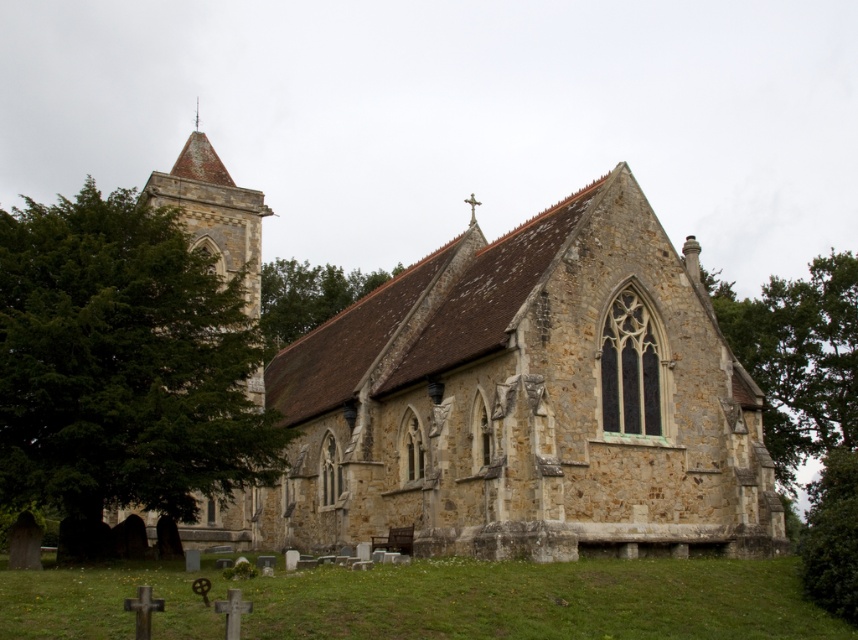
Can you confirm if green leafy tree at left is positioned to the right of green leafy tree at lower right?

In fact, green leafy tree at left is to the left of green leafy tree at lower right.

Between point (103, 337) and point (820, 577), which one is positioned in front?

Positioned in front is point (820, 577).

Does point (239, 376) come closer to viewer compared to point (831, 557)?

No, it is behind (831, 557).

This screenshot has width=858, height=640. In order to click on green leafy tree at left in this screenshot , I will do `click(121, 369)`.

Is green leafy tree at upper right positioned at the back of green leafy tree at center?

No.

Is point (814, 369) behind point (285, 266)?

No.

The image size is (858, 640). What do you see at coordinates (798, 356) in the screenshot?
I see `green leafy tree at upper right` at bounding box center [798, 356].

Identify the location of green leafy tree at upper right. (798, 356).

Identify the location of stone church at center. This screenshot has height=640, width=858. (523, 403).

Is point (621, 547) farther from viewer compared to point (805, 586)?

Yes, point (621, 547) is farther from viewer.

Describe the element at coordinates (523, 403) in the screenshot. I see `stone church at center` at that location.

Locate an element on the screen. The width and height of the screenshot is (858, 640). stone church at center is located at coordinates (523, 403).